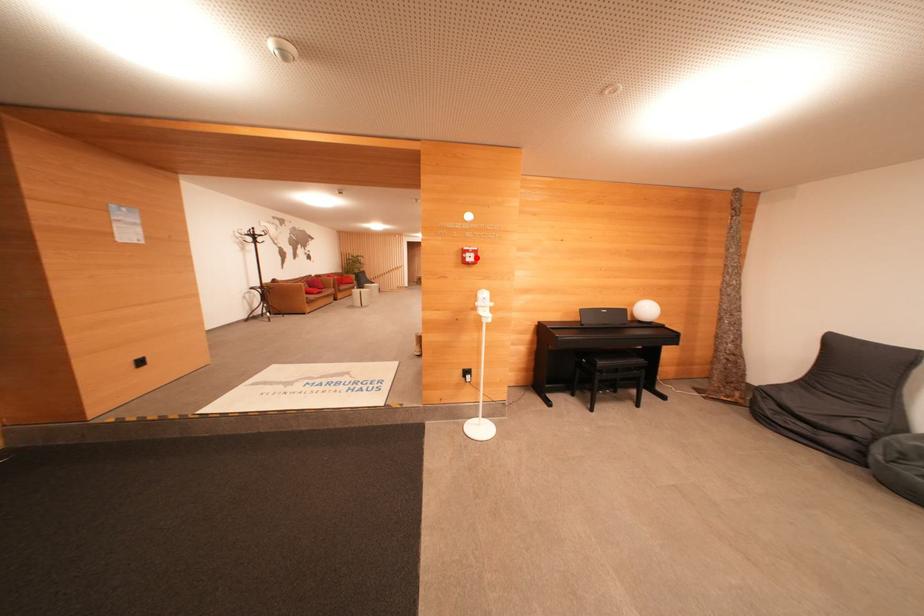
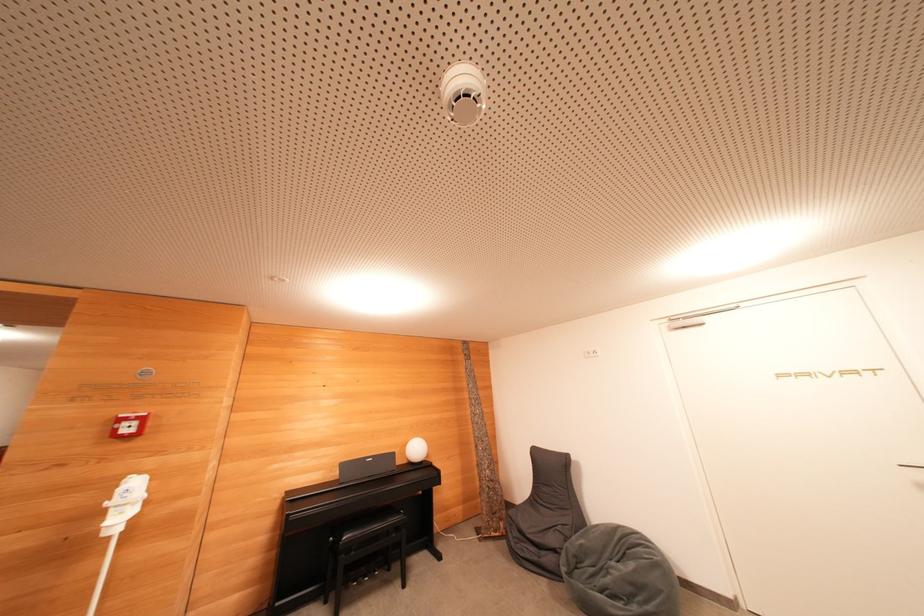
Locate, in the second image, the point that corresponds to the highlighted location in the first image.

(139, 427)